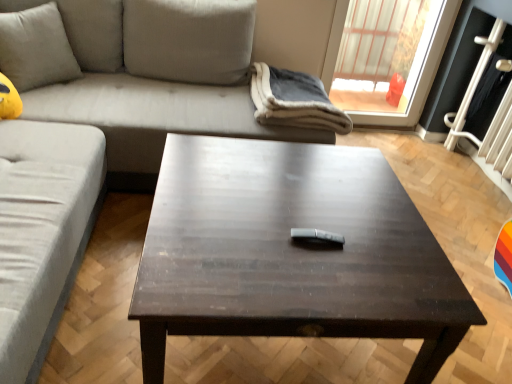
Question: Does light gray fabric couch at upper left, the second studio couch positioned from the front, turn towards soft gray fleece blanket at upper center?

Choices:
 (A) yes
 (B) no

Answer: (B)

Question: Is light gray fabric couch at upper left, which appears as the 1th studio couch when viewed from the back, far away from soft gray fleece blanket at upper center?

Choices:
 (A) no
 (B) yes

Answer: (A)

Question: Can you confirm if light gray fabric couch at upper left, the second studio couch positioned from the front, is smaller than soft gray fleece blanket at upper center?

Choices:
 (A) no
 (B) yes

Answer: (A)

Question: Considering the relative sizes of light gray fabric couch at upper left, which appears as the 1th studio couch when viewed from the back, and soft gray fleece blanket at upper center in the image provided, is light gray fabric couch at upper left, which appears as the 1th studio couch when viewed from the back, thinner than soft gray fleece blanket at upper center?

Choices:
 (A) yes
 (B) no

Answer: (B)

Question: Does light gray fabric couch at upper left, the second studio couch positioned from the front, have a lesser height compared to soft gray fleece blanket at upper center?

Choices:
 (A) no
 (B) yes

Answer: (A)

Question: Looking at the image, does satin silver remote at center seem bigger or smaller compared to suede gray couch at upper left, which ranks as the 1th studio couch in front-to-back order?

Choices:
 (A) big
 (B) small

Answer: (B)

Question: Does point (315, 238) appear closer or farther from the camera than point (110, 155)?

Choices:
 (A) closer
 (B) farther

Answer: (A)

Question: From their relative heights in the image, would you say satin silver remote at center is taller or shorter than suede gray couch at upper left, which ranks as the 1th studio couch in front-to-back order?

Choices:
 (A) short
 (B) tall

Answer: (A)

Question: Is satin silver remote at center to the left or to the right of suede gray couch at upper left, acting as the 2th studio couch starting from the back, in the image?

Choices:
 (A) left
 (B) right

Answer: (B)

Question: From the image's perspective, is light gray fabric couch at upper left, the second studio couch positioned from the front, located above or below dark wood/black table at center?

Choices:
 (A) below
 (B) above

Answer: (B)

Question: In the image, is light gray fabric couch at upper left, which appears as the 1th studio couch when viewed from the back, on the left side or the right side of dark wood/black table at center?

Choices:
 (A) left
 (B) right

Answer: (A)

Question: Does point (160, 79) appear closer or farther from the camera than point (386, 228)?

Choices:
 (A) closer
 (B) farther

Answer: (B)

Question: Would you say light gray fabric couch at upper left, which appears as the 1th studio couch when viewed from the back, is inside or outside dark wood/black table at center?

Choices:
 (A) outside
 (B) inside

Answer: (A)

Question: From the image's perspective, relative to black glass screen door at upper right, is soft beige cushion at upper left above or below?

Choices:
 (A) below
 (B) above

Answer: (B)

Question: In terms of width, does soft beige cushion at upper left look wider or thinner when compared to black glass screen door at upper right?

Choices:
 (A) thin
 (B) wide

Answer: (B)